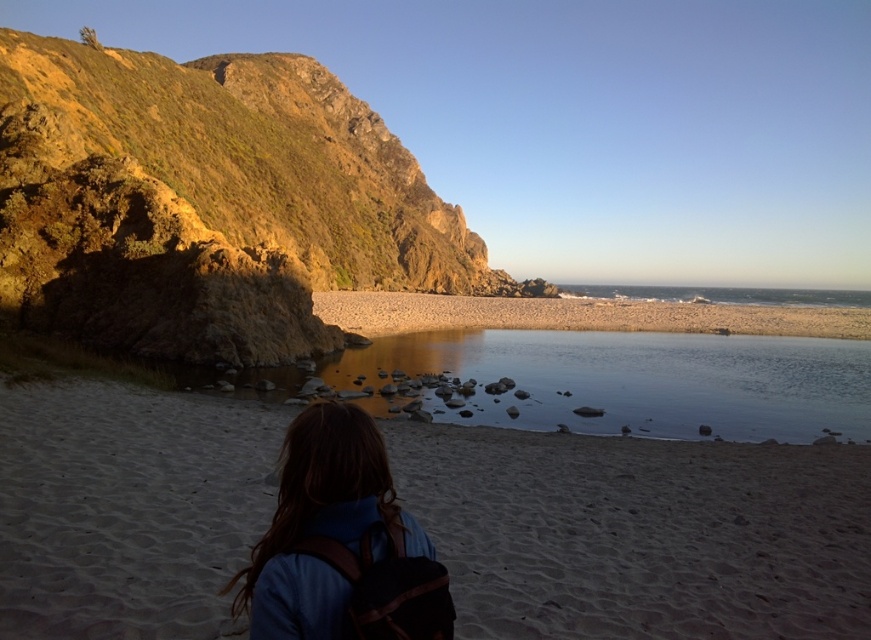
Who is taller, rustic stone cliff at left or smooth beige sand at center?

With more height is rustic stone cliff at left.

Does point (111, 304) come closer to viewer compared to point (814, 333)?

Yes, point (111, 304) is in front of point (814, 333).

Identify the location of rustic stone cliff at left. This screenshot has height=640, width=871. (208, 204).

Does rustic stone cliff at left have a greater width compared to brown hair at lower center?

Yes.

Is point (171, 348) closer to viewer compared to point (268, 570)?

No, (171, 348) is behind (268, 570).

Measure the distance between rustic stone cliff at left and camera.

They are 39.78 meters apart.

I want to click on rustic stone cliff at left, so click(x=208, y=204).

Is brown hair at lower center shorter than smooth beige sand at center?

Yes, brown hair at lower center is shorter than smooth beige sand at center.

Is point (377, 593) more distant than point (343, 301)?

No, (377, 593) is closer to viewer.

Locate an element on the screen. Image resolution: width=871 pixels, height=640 pixels. brown hair at lower center is located at coordinates (341, 544).